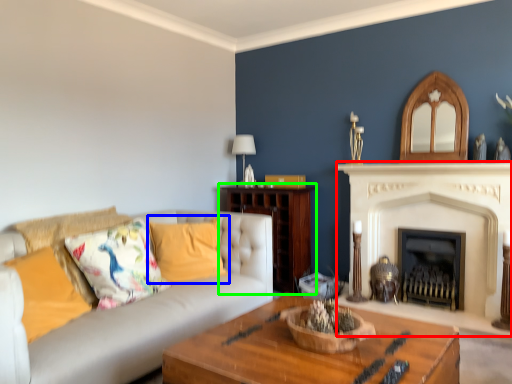
Question: Which object is positioned closest to fireplace (highlighted by a red box)? Select from pillow (highlighted by a blue box) and hardwood (highlighted by a green box).

Choices:
 (A) pillow
 (B) hardwood

Answer: (B)